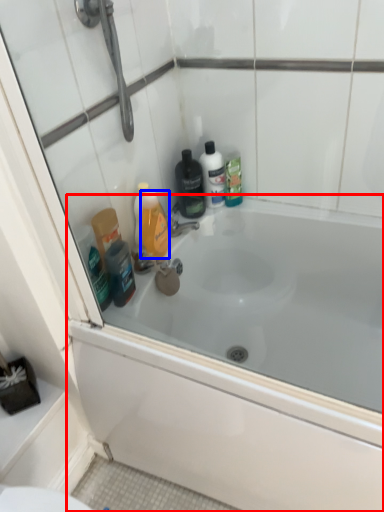
Question: Which object appears farthest to the camera in this image, bathtub (highlighted by a red box) or mouthwash (highlighted by a blue box)?

Choices:
 (A) bathtub
 (B) mouthwash

Answer: (B)